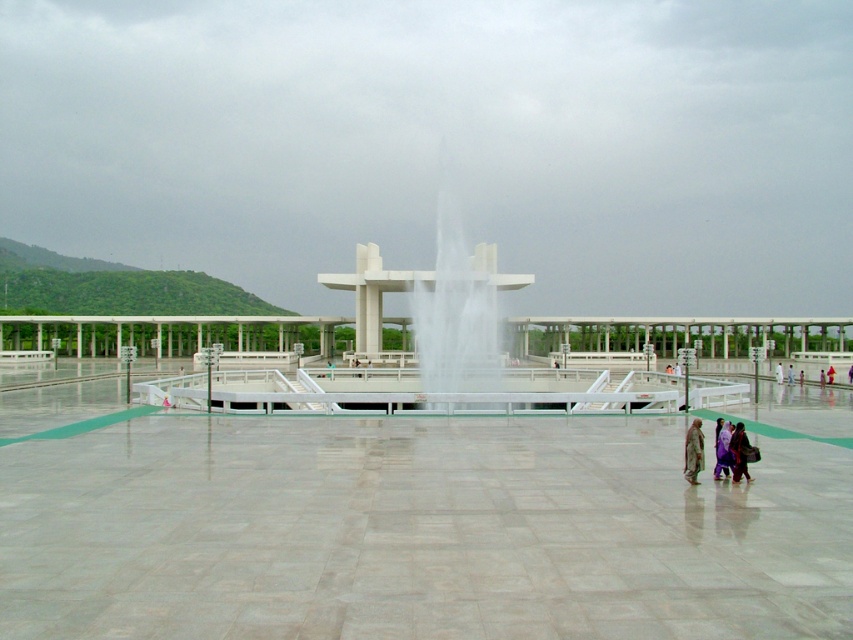
Question: Which object appears farthest from the camera in this image?

Choices:
 (A) white cloth at center
 (B) white fabric person at center
 (C) white glossy fountain at center
 (D) purple fabric dress at lower right

Answer: (A)

Question: Does white cloth at center have a smaller size compared to light purple fabric dress at lower right?

Choices:
 (A) no
 (B) yes

Answer: (A)

Question: Is purple fabric dress at lower right above white cloth at center?

Choices:
 (A) no
 (B) yes

Answer: (B)

Question: Where is white glossy fountain at center located in relation to light pink fabric dress at center in the image?

Choices:
 (A) below
 (B) above

Answer: (B)

Question: Which object appears closest to the camera in this image?

Choices:
 (A) light pink fabric dress at center
 (B) matte pink dress at center
 (C) white glossy fountain at center
 (D) white fabric person at center

Answer: (C)

Question: Which point is closer to the camera?

Choices:
 (A) purple fabric dress at lower right
 (B) white cloth at center
 (C) light purple fabric dress at lower right

Answer: (A)